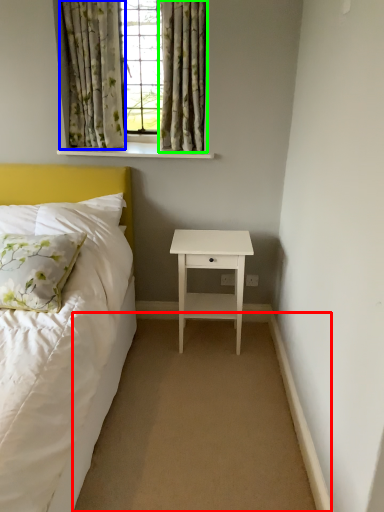
Question: Which object is the closest to the plain (highlighted by a red box)? Choose among these: curtain (highlighted by a blue box) or curtain (highlighted by a green box).

Choices:
 (A) curtain
 (B) curtain

Answer: (B)